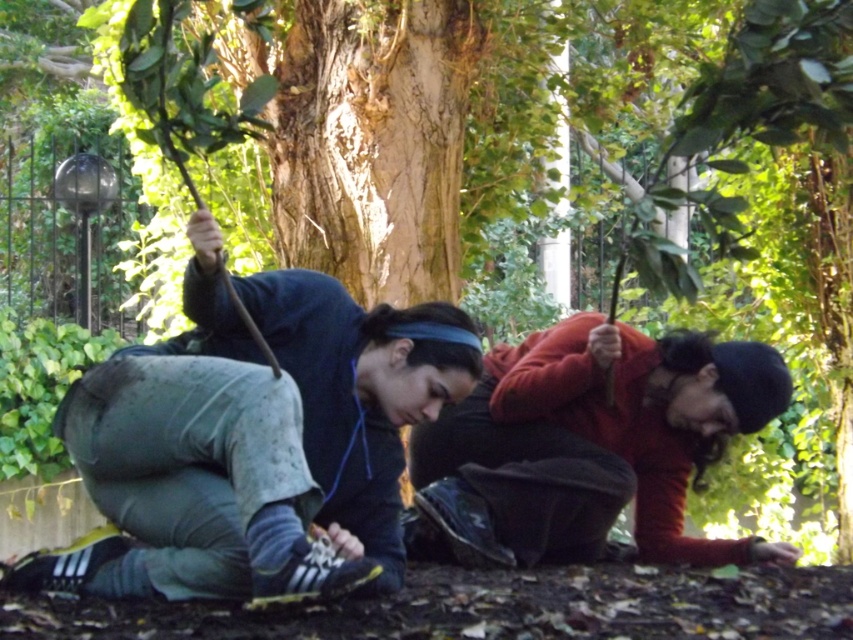
You are a gardener who needs to pass between the green camouflage pants at lower left and the red sweater at lower right. The path between them is narrow. Can you walk through this space comfortably if you need at least 3 feet of clearance?

The green camouflage pants at lower left and red sweater at lower right are 3.37 feet apart from each other. Since the minimum required clearance is 3 feet, the gardener can comfortably walk through the space between them.

You are standing in the garden and see the green camouflage pants at lower left. Where exactly are they located in the image?

The green camouflage pants at lower left are located at point (254, 440) in the image.

You are a photographer trying to capture both the green camouflage pants at lower left and the red sweater at lower right in a single frame. Based on their sizes in the image, which one might require you to zoom out more to include fully?

The red sweater at lower right requires zooming out more because it occupies more space than the green camouflage pants at lower left.